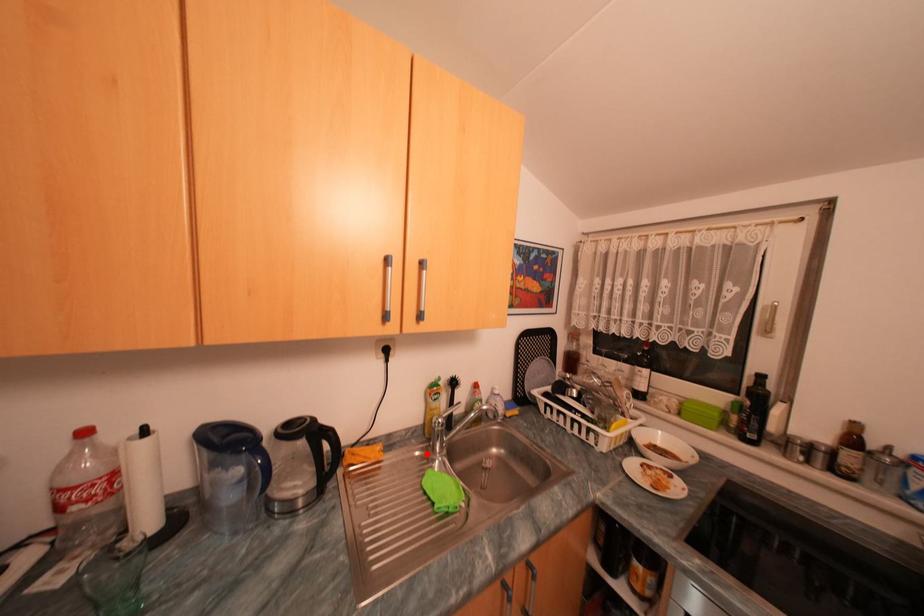
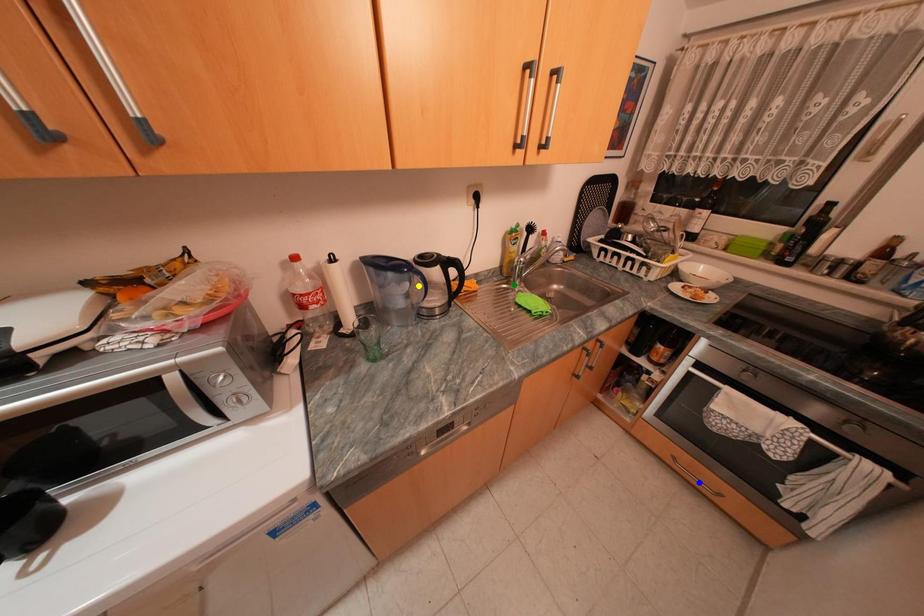
Question: I am providing you with two images of the same scene from different viewpoints. A red point is marked on the first image. You are given multiple points on the second image. Can you choose the point in image 2 that corresponds to the point in image 1?

Choices:
 (A) green point
 (B) blue point
 (C) yellow point

Answer: (A)